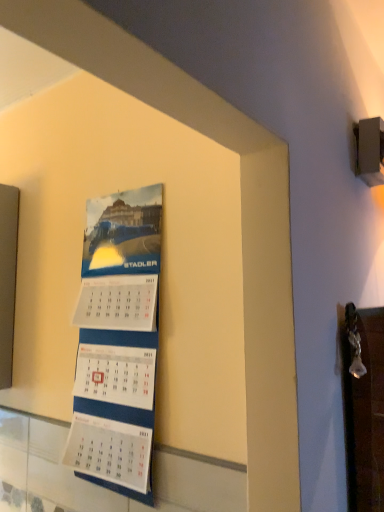
Locate an element on the screen. blue paper calendar at center is located at coordinates (117, 343).

The image size is (384, 512). What do you see at coordinates (117, 343) in the screenshot?
I see `blue paper calendar at center` at bounding box center [117, 343].

At what (x,y) coordinates should I click in order to perform the action: click on blue paper calendar at center. Please return your answer as a coordinate pair (x, y). The height and width of the screenshot is (512, 384). Looking at the image, I should click on (117, 343).